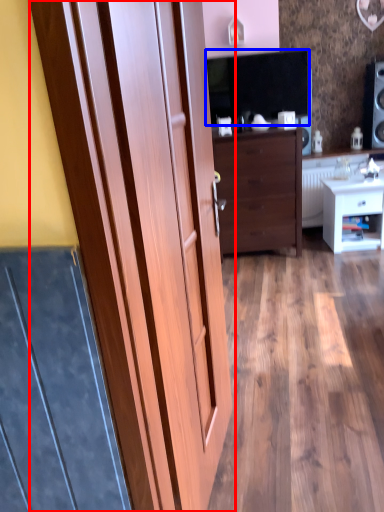
Question: Among these objects, which one is nearest to the camera, door (highlighted by a red box) or dark (highlighted by a blue box)?

Choices:
 (A) door
 (B) dark

Answer: (A)